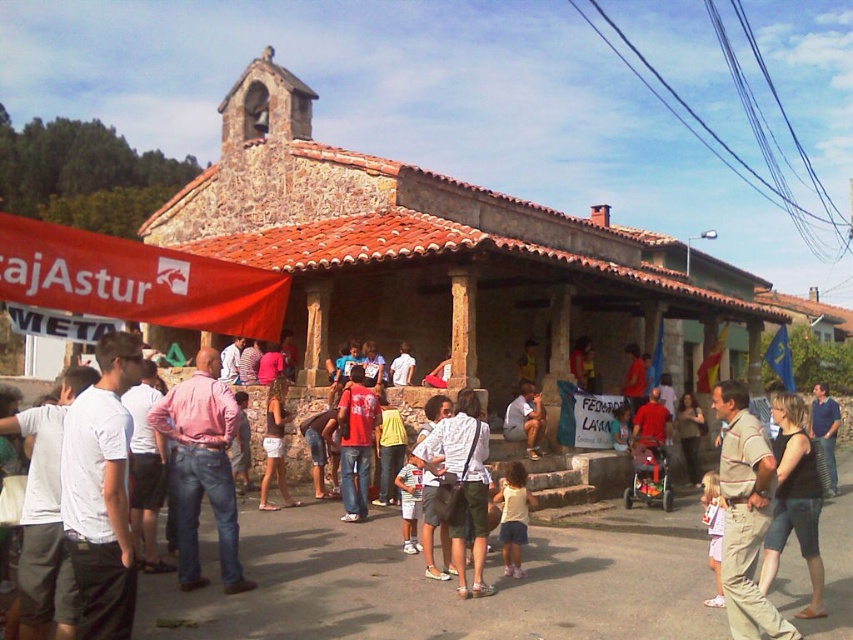
Is pink cotton shirt at center below light yellow shirt at center?

Actually, pink cotton shirt at center is above light yellow shirt at center.

Is pink cotton shirt at center smaller than light yellow shirt at center?

No.

Is point (245, 579) closer to viewer compared to point (508, 464)?

That is True.

Locate an element on the screen. pink cotton shirt at center is located at coordinates (202, 468).

I want to click on pink cotton shirt at center, so click(x=202, y=468).

Between point (195, 364) and point (770, 637), which one is positioned behind?

The point (195, 364) is more distant.

Identify the location of pink cotton shirt at center. Image resolution: width=853 pixels, height=640 pixels. (202, 468).

Is point (62, 291) positioned in front of point (535, 452)?

Yes.

At what (x,y) coordinates should I click in order to perform the action: click on red fabric banner at left. Please return your answer as a coordinate pair (x, y). The image size is (853, 640). Looking at the image, I should click on (135, 280).